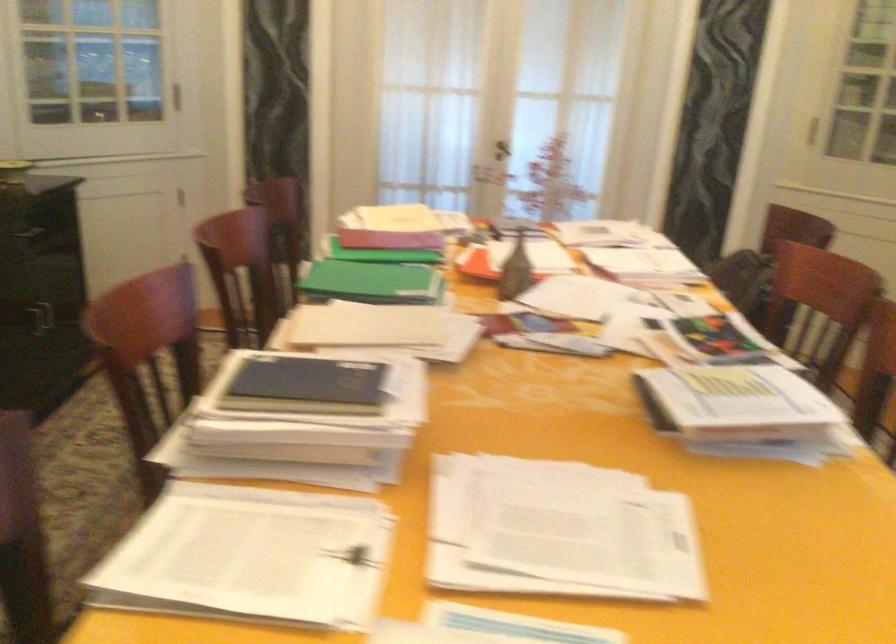
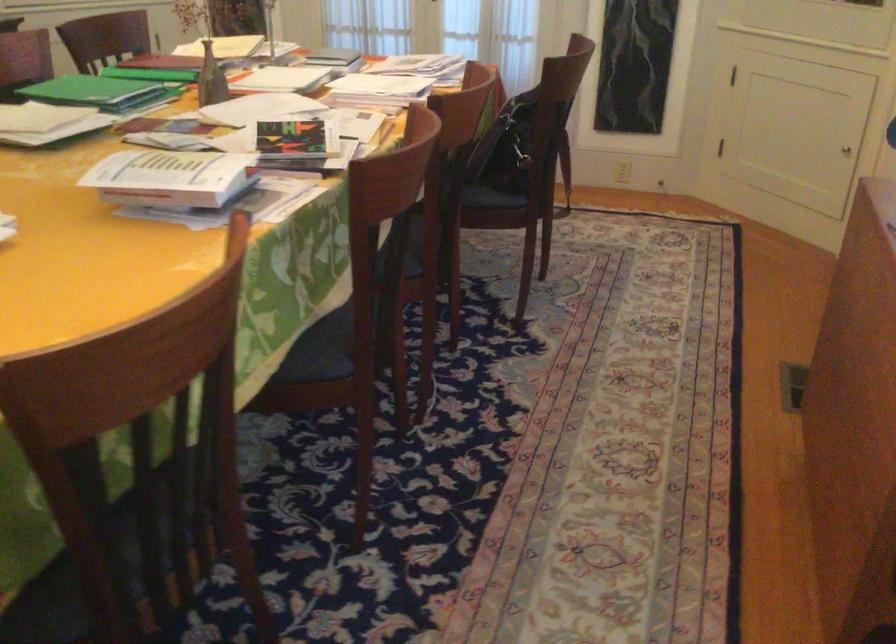
Where in the second image is the point corresponding to (407,299) from the first image?

(99, 91)